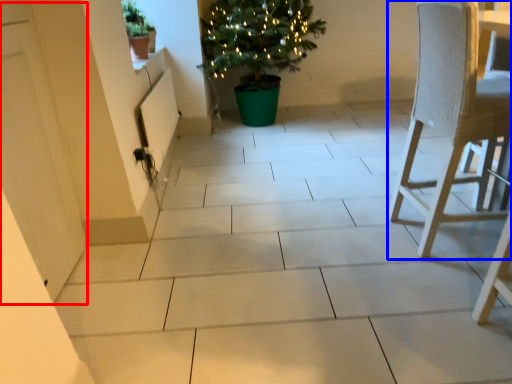
Question: Which object appears farthest to the camera in this image, screen door (highlighted by a red box) or chair (highlighted by a blue box)?

Choices:
 (A) screen door
 (B) chair

Answer: (B)